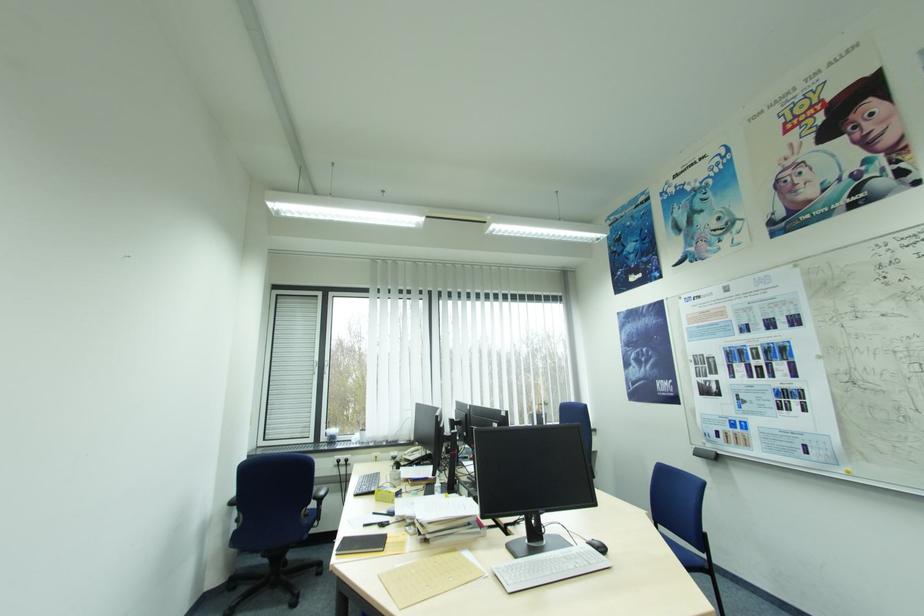
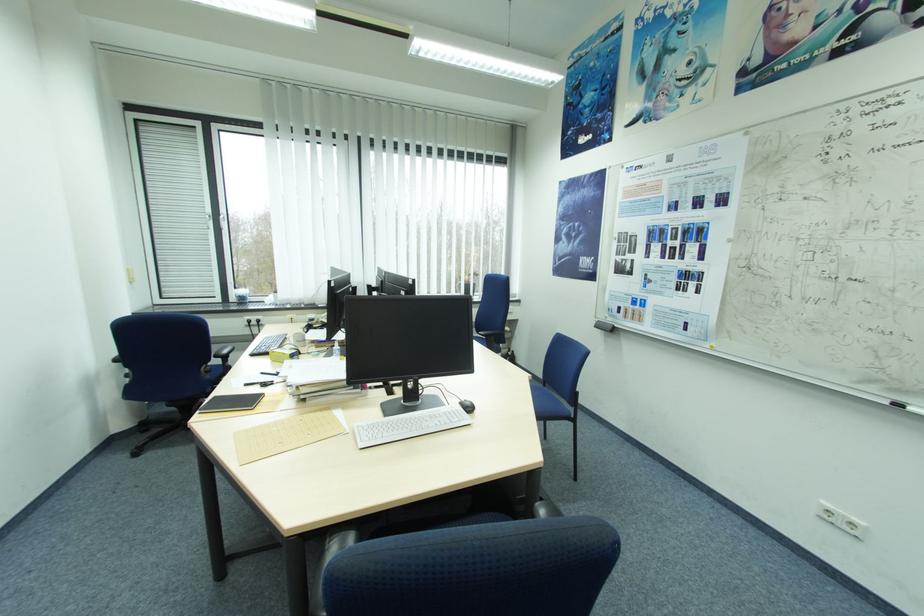
Question: The first image is from the beginning of the video and the second image is from the end. How did the camera likely rotate when shooting the video?

Choices:
 (A) Left
 (B) Right
 (C) Up
 (D) Down

Answer: (D)